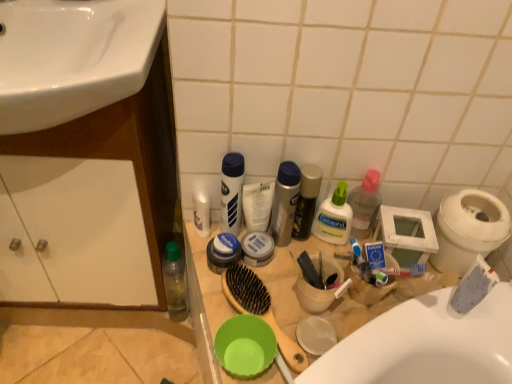
Question: From the image's perspective, would you say white pump bottle at center, which appears as the second toiletry when viewed from the right, is positioned over shiny black bottle at center, the third toiletry when ordered from right to left?

Choices:
 (A) no
 (B) yes

Answer: (A)

Question: From a real-world perspective, does white pump bottle at center, which appears as the second toiletry when viewed from the right, stand above shiny black bottle at center, the third toiletry when ordered from right to left?

Choices:
 (A) no
 (B) yes

Answer: (A)

Question: Considering the relative sizes of white pump bottle at center, which is the seventh toiletry from left to right, and shiny black bottle at center, the third toiletry when ordered from right to left, in the image provided, is white pump bottle at center, which is the seventh toiletry from left to right, shorter than shiny black bottle at center, the third toiletry when ordered from right to left,?

Choices:
 (A) yes
 (B) no

Answer: (A)

Question: Is shiny black bottle at center, the third toiletry when ordered from right to left, inside white pump bottle at center, which is the seventh toiletry from left to right?

Choices:
 (A) no
 (B) yes

Answer: (A)

Question: Is white pump bottle at center, which is the seventh toiletry from left to right, further to the viewer compared to shiny black bottle at center, the 6th toiletry in the left-to-right sequence?

Choices:
 (A) yes
 (B) no

Answer: (A)

Question: Is white pump bottle at center, which appears as the second toiletry when viewed from the right, bigger than shiny black bottle at center, the third toiletry when ordered from right to left?

Choices:
 (A) no
 (B) yes

Answer: (B)

Question: From the image's perspective, would you say silver metallic can at center, positioned as the fifth toiletry in left-to-right order, is shown under white plastic canister at center, which is the third toiletry in left-to-right order?

Choices:
 (A) no
 (B) yes

Answer: (B)

Question: Is silver metallic can at center, positioned as the fifth toiletry in left-to-right order, beside white plastic canister at center, the sixth toiletry in the right-to-left sequence?

Choices:
 (A) yes
 (B) no

Answer: (A)

Question: Does silver metallic can at center, the fourth toiletry in the right-to-left sequence, have a smaller size compared to white plastic canister at center, the sixth toiletry in the right-to-left sequence?

Choices:
 (A) yes
 (B) no

Answer: (B)

Question: From a real-world perspective, is silver metallic can at center, positioned as the fifth toiletry in left-to-right order, on top of white plastic canister at center, which is the third toiletry in left-to-right order?

Choices:
 (A) yes
 (B) no

Answer: (A)

Question: Considering the relative positions of silver metallic can at center, positioned as the fifth toiletry in left-to-right order, and white plastic canister at center, the sixth toiletry in the right-to-left sequence, in the image provided, is silver metallic can at center, positioned as the fifth toiletry in left-to-right order, to the left of white plastic canister at center, the sixth toiletry in the right-to-left sequence, from the viewer's perspective?

Choices:
 (A) no
 (B) yes

Answer: (A)

Question: Are silver metallic can at center, the fourth toiletry in the right-to-left sequence, and white plastic canister at center, the sixth toiletry in the right-to-left sequence, located far from each other?

Choices:
 (A) yes
 (B) no

Answer: (B)

Question: Can you confirm if white glossy sink at upper left is bigger than matte white cream container at center, acting as the fourth toiletry starting from the left?

Choices:
 (A) yes
 (B) no

Answer: (A)